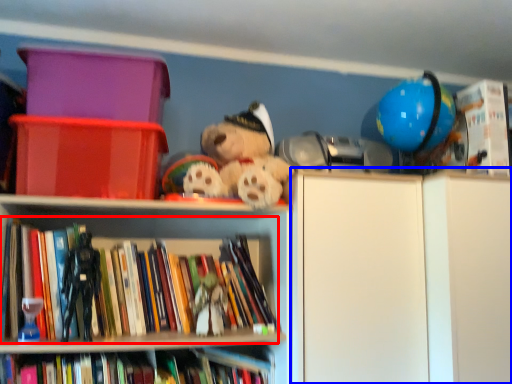
Question: Which of the following is the closest to the observer, book (highlighted by a red box) or cabinetry (highlighted by a blue box)?

Choices:
 (A) book
 (B) cabinetry

Answer: (A)